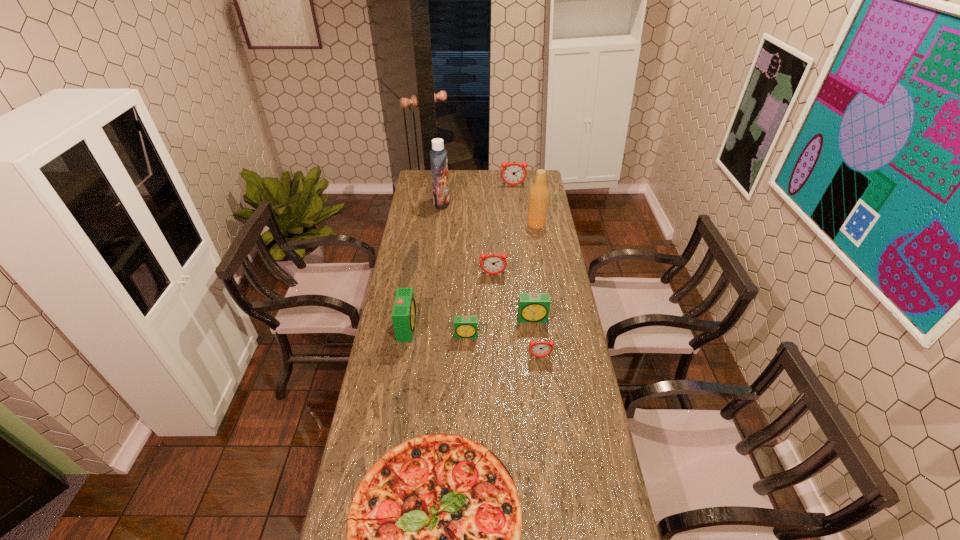
The height and width of the screenshot is (540, 960). I want to click on free space at the right edge of the desktop, so click(561, 483).

Locate an element on the screen. This screenshot has height=540, width=960. unoccupied area between the second smallest green alarm clock and the biggest reddish-pink alarm clock is located at coordinates (523, 252).

Identify the location of free space between the farthest object and the nearest reddish-pink alarm clock. The height and width of the screenshot is (540, 960). click(x=527, y=271).

Locate an element on the screen. free spot between the shampoo and the smallest green alarm clock is located at coordinates (454, 269).

Where is `free space between the rightmost green alarm clock and the nearest alarm clock`? free space between the rightmost green alarm clock and the nearest alarm clock is located at coordinates (537, 338).

Locate an element on the screen. vacant space in between the biggest green alarm clock and the farthest object is located at coordinates (460, 256).

The height and width of the screenshot is (540, 960). I want to click on blank region between the rightmost green alarm clock and the second green alarm clock from right to left, so click(x=500, y=327).

At what (x,y) coordinates should I click in order to perform the action: click on vacant space that's between the rightmost green alarm clock and the second nearest reddish-pink alarm clock. Please return your answer as a coordinate pair (x, y). This screenshot has height=540, width=960. Looking at the image, I should click on [514, 296].

Where is `the fifth closest object to the second nearest reddish-pink alarm clock`? This screenshot has width=960, height=540. the fifth closest object to the second nearest reddish-pink alarm clock is located at coordinates (541, 348).

The height and width of the screenshot is (540, 960). Identify the location of object identified as the closest to the second green alarm clock from left to right. (404, 314).